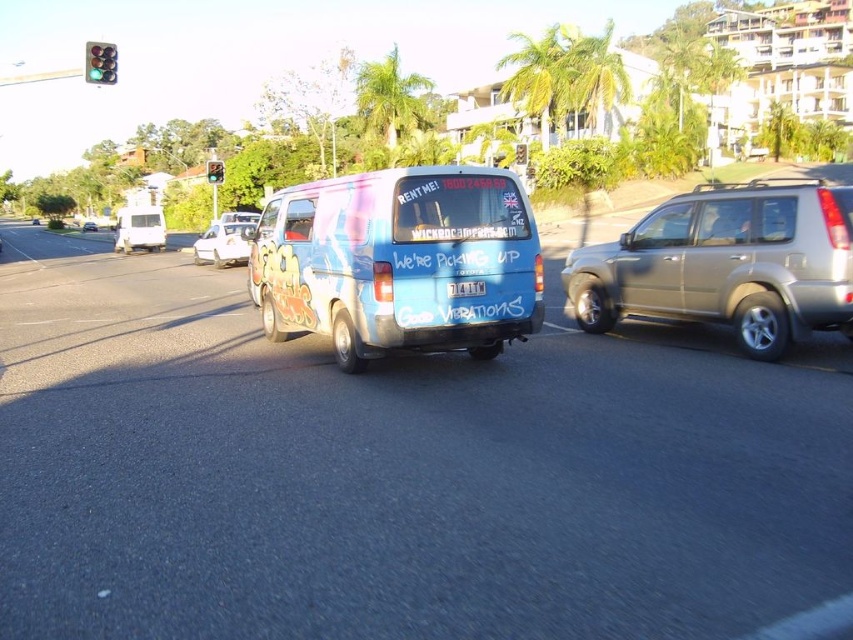
Who is lower down, white matte sedan at center or white matte van at left?

white matte sedan at center is below.

Between point (233, 224) and point (131, 205), which one is positioned in front?

Point (233, 224)

Where is `white matte sedan at center`? This screenshot has height=640, width=853. white matte sedan at center is located at coordinates point(224,243).

Based on the photo, is metallic silver suv at right closer to the viewer compared to white matte van at left?

Yes, metallic silver suv at right is in front of white matte van at left.

Does metallic silver suv at right appear on the left side of white matte van at left?

Incorrect, metallic silver suv at right is not on the left side of white matte van at left.

Does point (606, 324) lie behind point (134, 237)?

No.

The width and height of the screenshot is (853, 640). What are the coordinates of `metallic silver suv at right` in the screenshot? It's located at (726, 264).

Can you confirm if metallic glass traffic light at upper left is smaller than matte white van at center?

No, metallic glass traffic light at upper left is not smaller than matte white van at center.

Is point (106, 74) positioned after point (93, 227)?

That is False.

Image resolution: width=853 pixels, height=640 pixels. What are the coordinates of `metallic glass traffic light at upper left` in the screenshot? It's located at (100, 61).